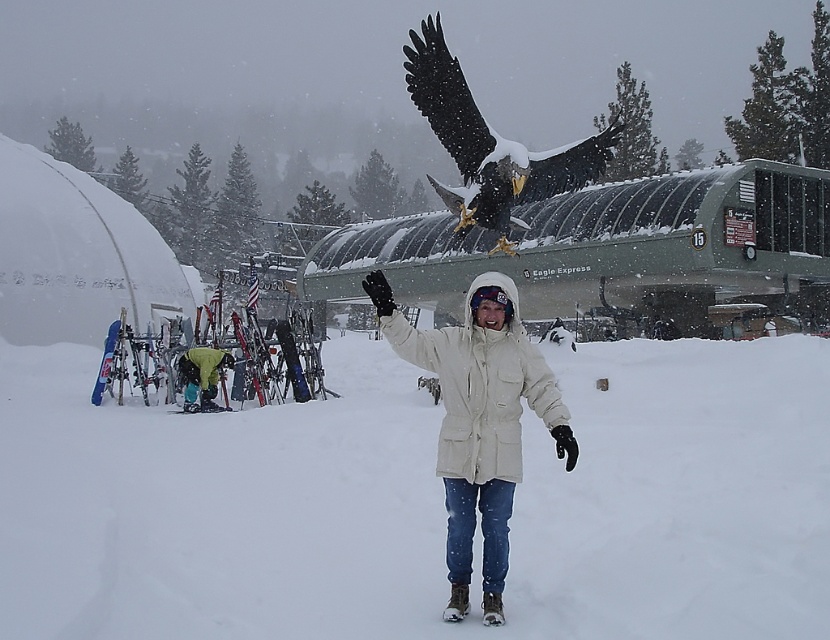
Between green snowsuit at lower left and transparent plastic goggles at center, which one has more height?

Standing taller between the two is green snowsuit at lower left.

Who is more distant from viewer, (227, 356) or (494, 298)?

Positioned behind is point (227, 356).

The image size is (830, 640). Identify the location of green snowsuit at lower left. (201, 378).

Does white matte glove at center have a greater height compared to green snowsuit at lower left?

In fact, white matte glove at center may be shorter than green snowsuit at lower left.

Can you confirm if white matte glove at center is positioned below green snowsuit at lower left?

Incorrect, white matte glove at center is not positioned below green snowsuit at lower left.

Which is behind, point (394, 324) or point (196, 403)?

The point (196, 403) is behind.

Image resolution: width=830 pixels, height=640 pixels. In order to click on white matte glove at center in this screenshot , I will do `click(399, 324)`.

Based on the photo, who is positioned more to the left, snow-covered eagle at upper center or transparent plastic goggles at center?

Positioned to the left is transparent plastic goggles at center.

Consider the image. Is snow-covered eagle at upper center to the right of transparent plastic goggles at center from the viewer's perspective?

Correct, you'll find snow-covered eagle at upper center to the right of transparent plastic goggles at center.

The height and width of the screenshot is (640, 830). I want to click on snow-covered eagle at upper center, so click(491, 145).

What are the coordinates of `snow-covered eagle at upper center` in the screenshot? It's located at (491, 145).